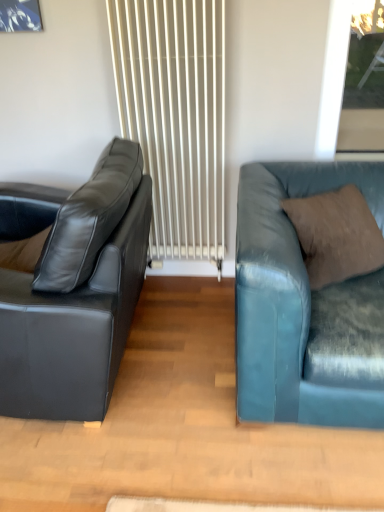
Question: Visually, is brown suede pillow at right positioned to the left or to the right of transparent glass window at upper right?

Choices:
 (A) left
 (B) right

Answer: (A)

Question: Is point coord(339,214) positioned closer to the camera than point coord(339,124)?

Choices:
 (A) farther
 (B) closer

Answer: (B)

Question: Based on their relative distances, which object is farther from the brown suede pillow at right?

Choices:
 (A) white textured radiator at center
 (B) matte black leather couch at left, which is the first studio couch in left-to-right order
 (C) teal leather couch at right, the 2th studio couch positioned from the left
 (D) transparent glass window at upper right

Answer: (D)

Question: Which of these objects is positioned closest to the white textured radiator at center?

Choices:
 (A) teal leather couch at right, the 2th studio couch positioned from the left
 (B) matte black leather couch at left, which is the first studio couch in left-to-right order
 (C) transparent glass window at upper right
 (D) brown suede pillow at right

Answer: (B)